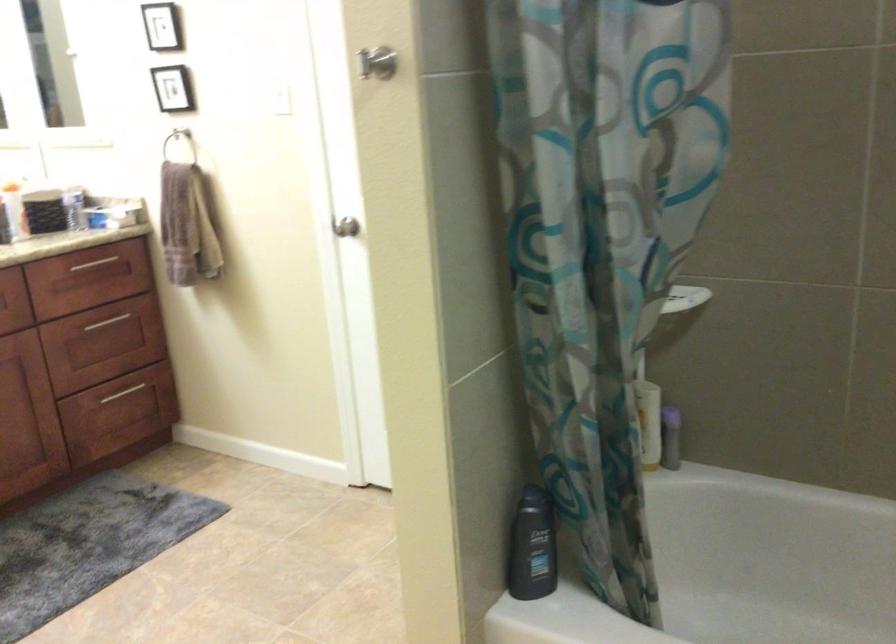
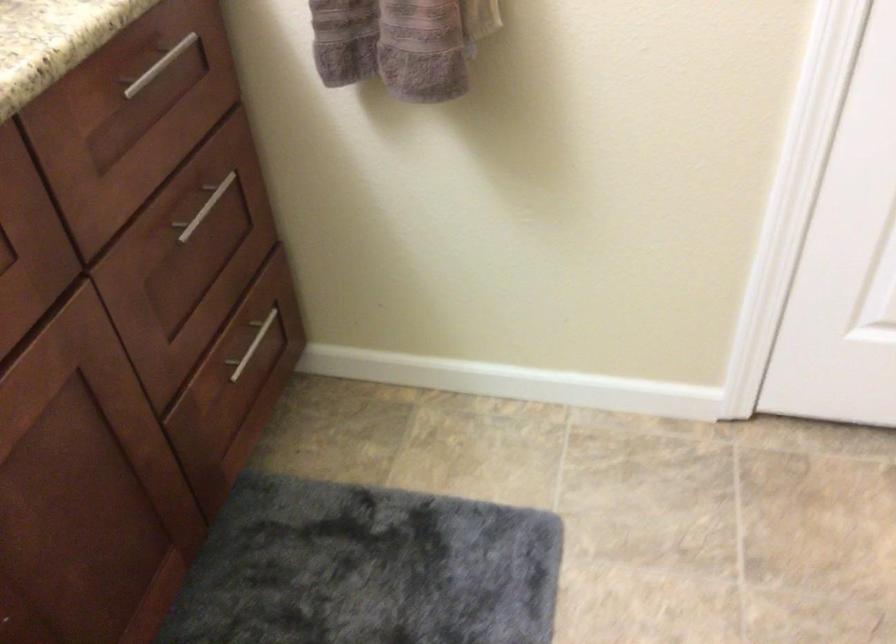
The point at (102, 259) is marked in the first image. Where is the corresponding point in the second image?

(159, 66)